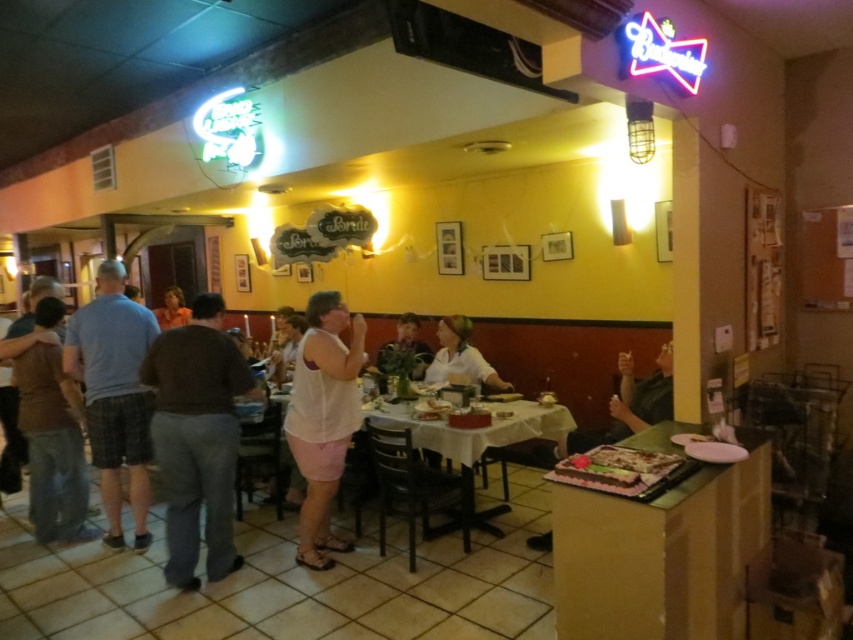
Is smooth white shirt at center to the left of orange fabric shirt at center from the viewer's perspective?

No, smooth white shirt at center is not to the left of orange fabric shirt at center.

Does smooth white shirt at center have a greater width compared to orange fabric shirt at center?

Incorrect, smooth white shirt at center's width does not surpass orange fabric shirt at center's.

This screenshot has height=640, width=853. What do you see at coordinates (405, 344) in the screenshot?
I see `smooth white shirt at center` at bounding box center [405, 344].

Identify the location of smooth white shirt at center. pos(405,344).

Can you confirm if chocolate cake at right is taller than chocolate frosted cake at lower right?

Indeed, chocolate cake at right has a greater height compared to chocolate frosted cake at lower right.

Is point (659, 432) in front of point (595, 464)?

That is False.

The image size is (853, 640). Identify the location of chocolate cake at right. (662, 554).

Does white tablecloth at center have a lesser height compared to orange fabric shirt at center?

In fact, white tablecloth at center may be taller than orange fabric shirt at center.

Is white tablecloth at center bigger than orange fabric shirt at center?

Indeed, white tablecloth at center has a larger size compared to orange fabric shirt at center.

Is point (395, 422) farther from viewer compared to point (181, 305)?

No.

The image size is (853, 640). I want to click on white tablecloth at center, so click(x=477, y=440).